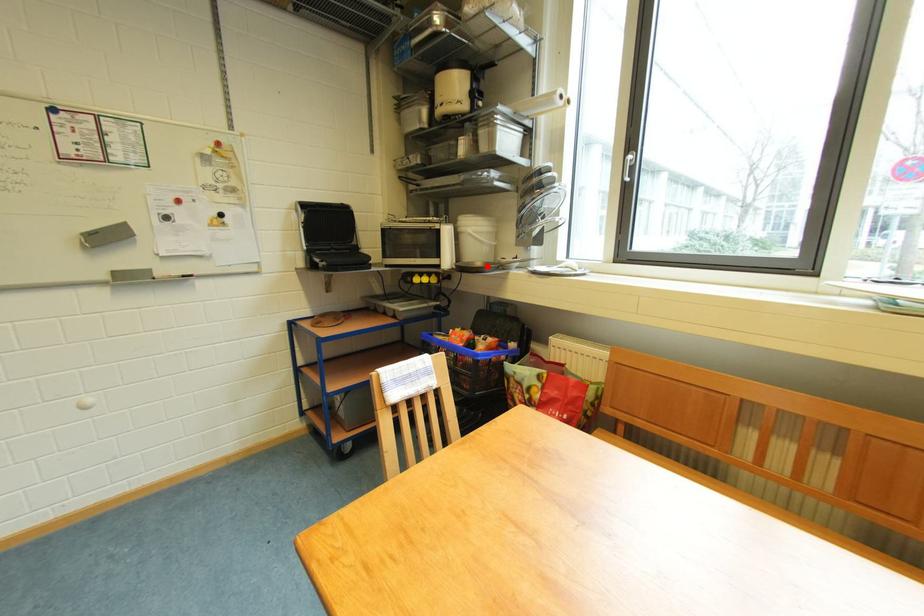
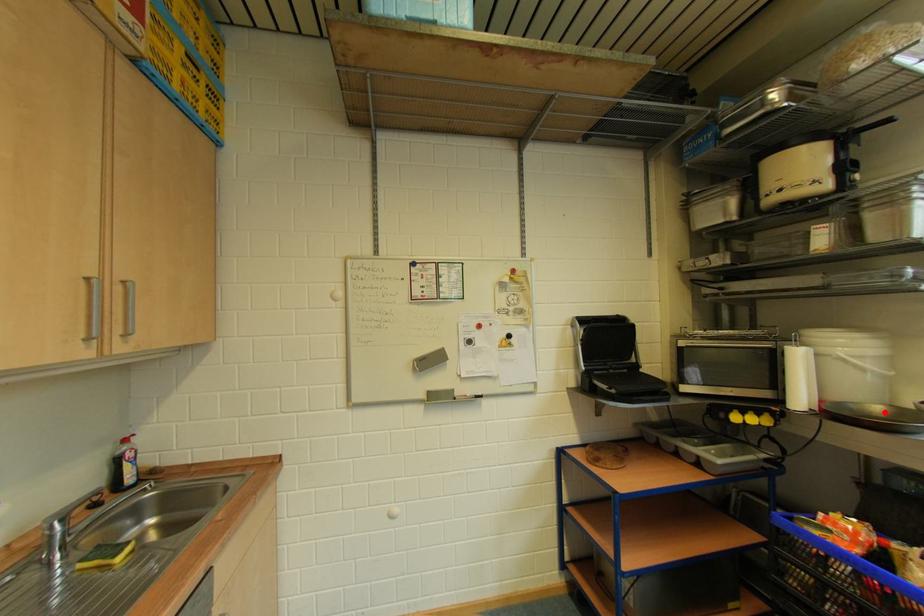
Consider the image. I am providing you with two images of the same scene from different viewpoints. A red point is marked on the first image and another point is marked on the second image. Are the points marked in image1 and image2 representing the same 3D position?

Yes